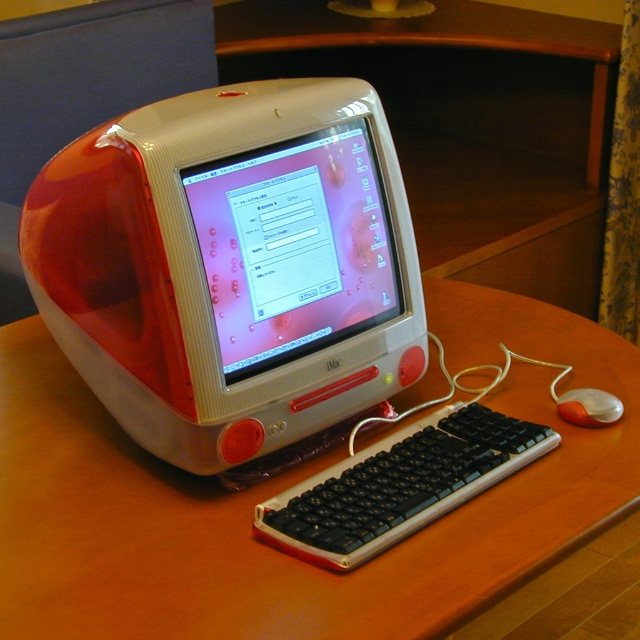
Question: Which point is farther to the camera?

Choices:
 (A) orange matte mouse at lower right
 (B) translucent red plastic imac at center
 (C) black plastic keyboard at center
 (D) white glossy monitor at center

Answer: (A)

Question: Observing the image, what is the correct spatial positioning of translucent red plastic imac at center in reference to wooden at center?

Choices:
 (A) above
 (B) below

Answer: (A)

Question: Does wooden at center lie in front of white glossy monitor at center?

Choices:
 (A) yes
 (B) no

Answer: (A)

Question: Which of the following is the farthest from the observer?

Choices:
 (A) orange matte mouse at lower right
 (B) white glossy monitor at center

Answer: (A)

Question: Does translucent red plastic imac at center lie behind wooden at center?

Choices:
 (A) yes
 (B) no

Answer: (A)

Question: Among these points, which one is farthest from the camera?

Choices:
 (A) (328, 264)
 (B) (186, 147)
 (C) (388, 442)
 (D) (580, 388)

Answer: (D)